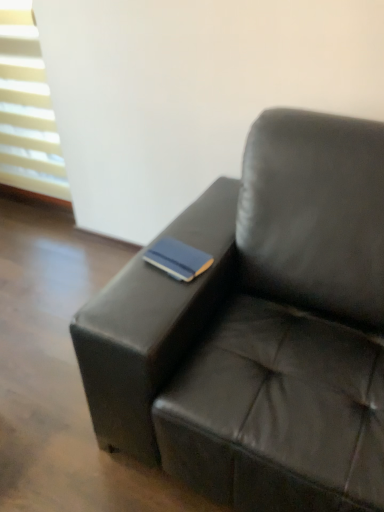
The image size is (384, 512). What do you see at coordinates (258, 329) in the screenshot?
I see `black leather couch at center` at bounding box center [258, 329].

Describe the element at coordinates (178, 259) in the screenshot. I see `blue matte book at center` at that location.

You are a GUI agent. You are given a task and a screenshot of the screen. Output one action in this format:
    pyautogui.click(x=<x>, y=<y>)
    Task: Click on the white plastic blinds at upper left
    This screenshot has height=512, width=384.
    Given the screenshot: What is the action you would take?
    pyautogui.click(x=27, y=109)

You are a GUI agent. You are given a task and a screenshot of the screen. Output one action in this format:
    pyautogui.click(x=<x>, y=<y>)
    Task: Click on the studio couch in front of the blue matte book at center
    The height and width of the screenshot is (512, 384).
    Given the screenshot: What is the action you would take?
    pyautogui.click(x=258, y=329)

Is blue matte book at center completely or partially inside black leather couch at center?

Yes, blue matte book at center is a part of black leather couch at center.

Is black leather couch at center positioned in front of blue matte book at center?

That is True.

Considering the sizes of objects black leather couch at center and blue matte book at center in the image provided, who is bigger, black leather couch at center or blue matte book at center?

Bigger between the two is black leather couch at center.

From a real-world perspective, who is located lower, black leather couch at center or white plastic blinds at upper left?

black leather couch at center is physically lower.

Is black leather couch at center oriented towards white plastic blinds at upper left?

No, black leather couch at center does not turn towards white plastic blinds at upper left.

Can white plastic blinds at upper left be found inside black leather couch at center?

That's incorrect, white plastic blinds at upper left is not inside black leather couch at center.

Considering the sizes of objects blue matte book at center and white plastic blinds at upper left in the image provided, who is wider, blue matte book at center or white plastic blinds at upper left?

white plastic blinds at upper left.

Can you confirm if blue matte book at center is shorter than white plastic blinds at upper left?

Yes.

Would you say blue matte book at center is a long distance from white plastic blinds at upper left?

Yes, blue matte book at center and white plastic blinds at upper left are quite far apart.

Is blue matte book at center not inside white plastic blinds at upper left?

Yes, blue matte book at center is located beyond the bounds of white plastic blinds at upper left.

Considering the relative positions of white plastic blinds at upper left and blue matte book at center in the image provided, is white plastic blinds at upper left in front of blue matte book at center?

No, white plastic blinds at upper left is further to the viewer.

Is white plastic blinds at upper left outside of blue matte book at center?

Yes, white plastic blinds at upper left is located beyond the bounds of blue matte book at center.

Is white plastic blinds at upper left shorter than blue matte book at center?

In fact, white plastic blinds at upper left may be taller than blue matte book at center.

Which object is positioned more to the left, blue matte book at center or black leather couch at center?

Positioned to the left is blue matte book at center.

From the picture: Can you tell me how much blue matte book at center and black leather couch at center differ in facing direction?

The facing directions of blue matte book at center and black leather couch at center are 10.8 degrees apart.

Is point (198, 264) more distant than point (325, 366)?

Yes, it is behind point (325, 366).

Is point (8, 9) farther from camera compared to point (117, 395)?

Yes, point (8, 9) is behind point (117, 395).

Looking at this image, between white plastic blinds at upper left and black leather couch at center, which one has larger size?

Bigger between the two is black leather couch at center.

Which of these two, white plastic blinds at upper left or black leather couch at center, is thinner?

With smaller width is white plastic blinds at upper left.

Which is more to the left, white plastic blinds at upper left or black leather couch at center?

white plastic blinds at upper left is more to the left.

In the image, there is a black leather couch at center. In order to click on paperback book above it (from the image's perspective) in this screenshot , I will do `click(178, 259)`.

At what (x,y) coordinates should I click in order to perform the action: click on studio couch on the right of the white plastic blinds at upper left. Please return your answer as a coordinate pair (x, y). This screenshot has height=512, width=384. Looking at the image, I should click on (258, 329).

Looking at the image, which one is located further to white plastic blinds at upper left, blue matte book at center or black leather couch at center?

The object further to white plastic blinds at upper left is black leather couch at center.

Estimate the real-world distances between objects in this image. Which object is further from white plastic blinds at upper left, black leather couch at center or blue matte book at center?

black leather couch at center is positioned further to the anchor white plastic blinds at upper left.

Looking at this image, from the image, which object appears to be nearer to black leather couch at center, blue matte book at center or white plastic blinds at upper left?

blue matte book at center is positioned closer to the anchor black leather couch at center.

Looking at the image, which one is located further to blue matte book at center, white plastic blinds at upper left or black leather couch at center?

Among the two, white plastic blinds at upper left is located further to blue matte book at center.

From the image, which object appears to be farther from black leather couch at center, white plastic blinds at upper left or blue matte book at center?

white plastic blinds at upper left is positioned further to the anchor black leather couch at center.

From the image, which object appears to be farther from blue matte book at center, black leather couch at center or white plastic blinds at upper left?

white plastic blinds at upper left.

This screenshot has width=384, height=512. I want to click on paperback book positioned between black leather couch at center and white plastic blinds at upper left from near to far, so click(178, 259).